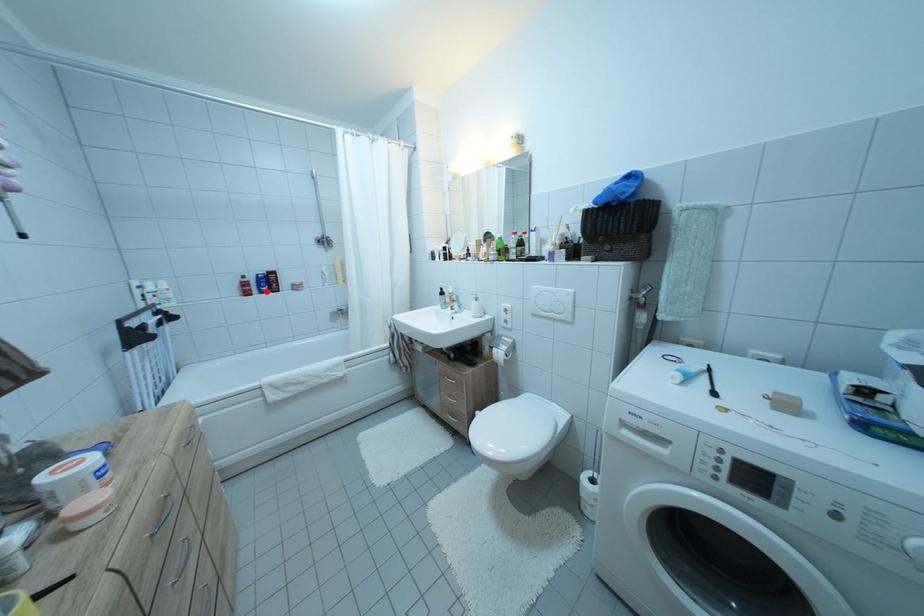
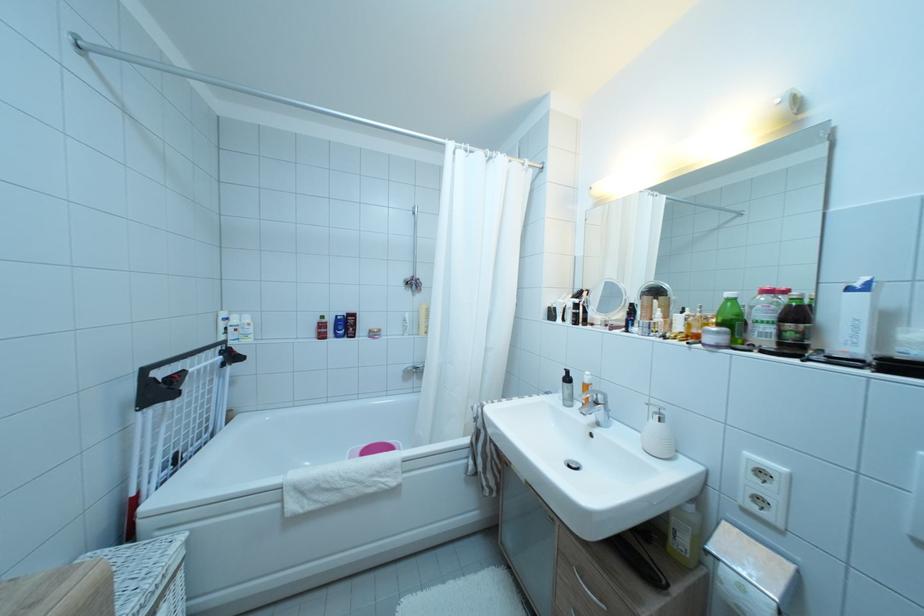
Find the pixel in the second image that matches the highlighted location in the first image.

(343, 334)